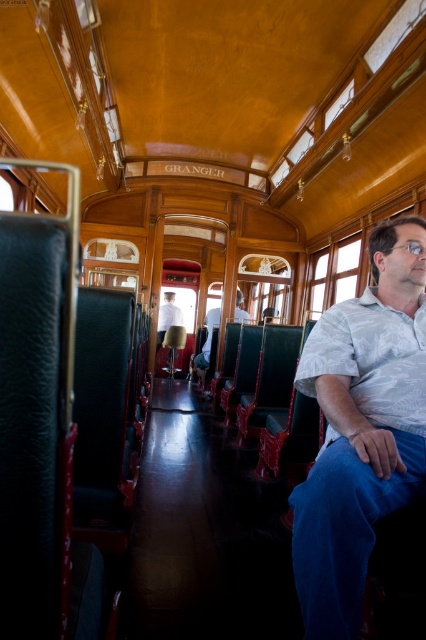
You are standing in the GRANGER train car and need to reach both the white cotton shirt at center and the light blue shirt at center. If you can only move forward in a straight line, which shirt will you encounter first?

The white cotton shirt at center and the light blue shirt at center are both at the same distance from you since they are both at the center of the image. However, according to the description, the white cotton shirt at center is 20.24 feet away from the light blue shirt at center, meaning they are positioned side by side rather than one in front of the other. Therefore, moving straight forward, you would not encounter either first as they are at the same central position.

You are a passenger on the GRANGER train car and you want to hand a book to someone wearing a light blue shirt at center from your position near the white shirt at center. Can you reach them without moving from your seat if your arm can extend 1.5 meters?

The light blue shirt at center and white shirt at center are 1.68 meters apart. Since your arm can only extend 1.5 meters, you cannot reach them without moving from your seat.

You are a passenger on the GRANGER train car and want to move from the white cotton shirt at center to the white shirt at center. Is there enough space for you to walk between them?

The distance between the white cotton shirt at center and the white shirt at center is 8.82 meters, so there is sufficient space for you to walk between them.